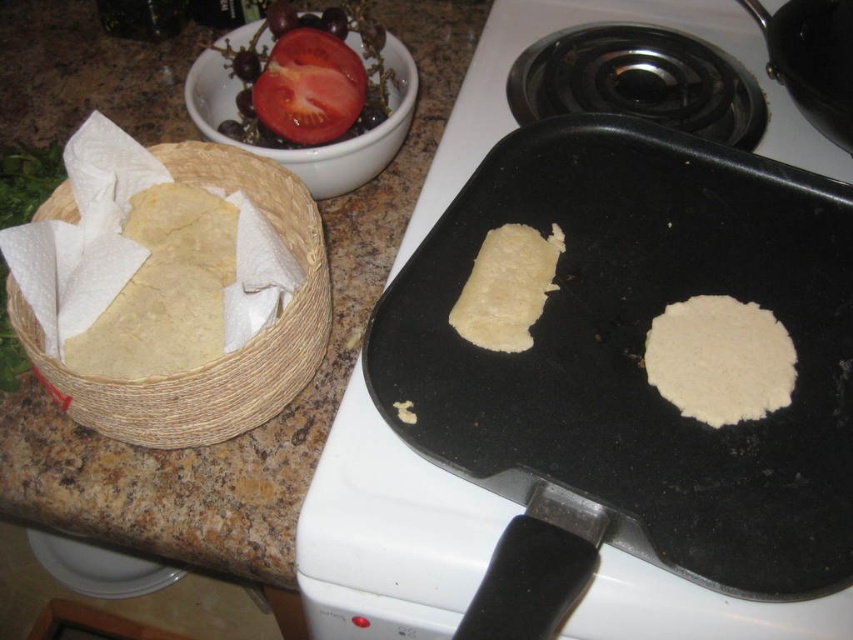
Is red matte tomato at upper left bigger than white matte tortilla at center?

Actually, red matte tomato at upper left might be smaller than white matte tortilla at center.

Can you confirm if red matte tomato at upper left is wider than white matte tortilla at center?

Yes.

Who is more distant from viewer, (329, 138) or (459, 304)?

The point (329, 138) is behind.

At what (x,y) coordinates should I click in order to perform the action: click on red matte tomato at upper left. Please return your answer as a coordinate pair (x, y). This screenshot has width=853, height=640. Looking at the image, I should click on (309, 88).

Who is more distant from viewer, [577,138] or [519,243]?

Positioned behind is point [577,138].

In the scene shown: Can you confirm if matte black griddle at center is positioned to the right of white matte tortilla at center?

Yes, matte black griddle at center is to the right of white matte tortilla at center.

Which is in front, point (611, 132) or point (543, 296)?

Point (543, 296) is in front.

Where is `matte black griddle at center`? The image size is (853, 640). matte black griddle at center is located at coordinates (631, 368).

Image resolution: width=853 pixels, height=640 pixels. In order to click on matte black griddle at center in this screenshot , I will do `click(631, 368)`.

Does matte black griddle at center come behind woven straw basket at left?

No, it is not.

What do you see at coordinates (631, 368) in the screenshot? This screenshot has width=853, height=640. I see `matte black griddle at center` at bounding box center [631, 368].

I want to click on matte black griddle at center, so click(631, 368).